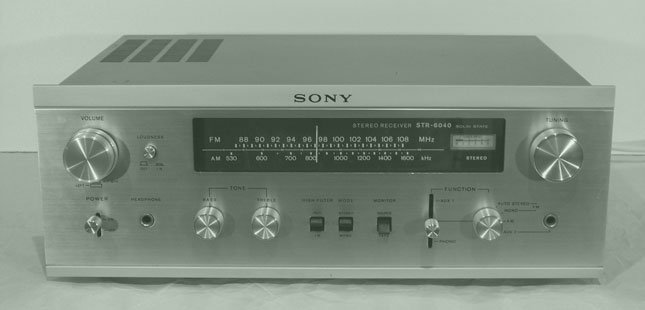
Image resolution: width=645 pixels, height=310 pixels. Find the location of `table`. table is located at coordinates (24, 227).